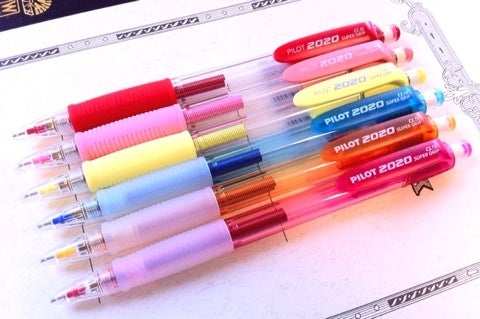
Where is `colored pens`? colored pens is located at coordinates (237, 229), (237, 194), (231, 167), (218, 130), (212, 107), (207, 85).